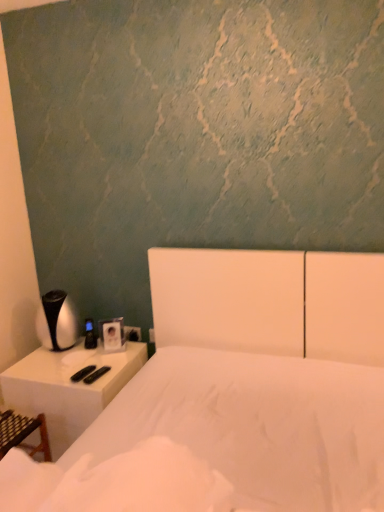
Question: Does white matte bed at center appear on the left side of white plastic nightstand at left?

Choices:
 (A) yes
 (B) no

Answer: (B)

Question: Can white plastic nightstand at left be found inside white matte bed at center?

Choices:
 (A) no
 (B) yes

Answer: (A)

Question: Is white matte bed at center behind white plastic nightstand at left?

Choices:
 (A) no
 (B) yes

Answer: (A)

Question: Is white matte bed at center completely or partially outside of white plastic nightstand at left?

Choices:
 (A) yes
 (B) no

Answer: (A)

Question: Considering the relative sizes of white matte bed at center and white plastic nightstand at left in the image provided, is white matte bed at center wider than white plastic nightstand at left?

Choices:
 (A) yes
 (B) no

Answer: (A)

Question: Is white matte bed at center directly adjacent to white plastic nightstand at left?

Choices:
 (A) yes
 (B) no

Answer: (B)

Question: Can you confirm if white plastic nightstand at left is thinner than white plastic electric outlet at lower center?

Choices:
 (A) no
 (B) yes

Answer: (A)

Question: Does white plastic nightstand at left turn towards white plastic electric outlet at lower center?

Choices:
 (A) yes
 (B) no

Answer: (B)

Question: Is white plastic nightstand at left to the left of white plastic electric outlet at lower center from the viewer's perspective?

Choices:
 (A) yes
 (B) no

Answer: (A)

Question: Can you confirm if white plastic nightstand at left is taller than white plastic electric outlet at lower center?

Choices:
 (A) no
 (B) yes

Answer: (B)

Question: Would you consider white plastic nightstand at left to be distant from white plastic electric outlet at lower center?

Choices:
 (A) no
 (B) yes

Answer: (A)

Question: From the image's perspective, is white plastic nightstand at left above white plastic electric outlet at lower center?

Choices:
 (A) no
 (B) yes

Answer: (A)

Question: Is white matte bed at center taller than white plastic electric outlet at lower center?

Choices:
 (A) yes
 (B) no

Answer: (A)